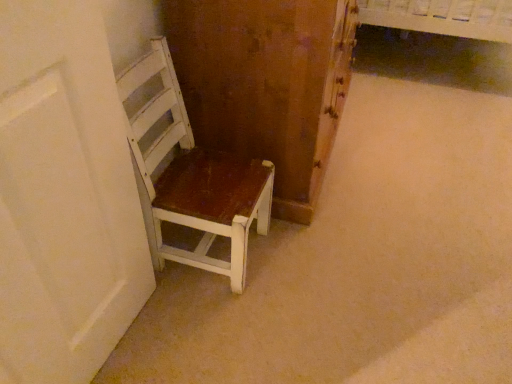
The image size is (512, 384). Find the location of `free spot in front of white painted wood chair at left`. free spot in front of white painted wood chair at left is located at coordinates (200, 326).